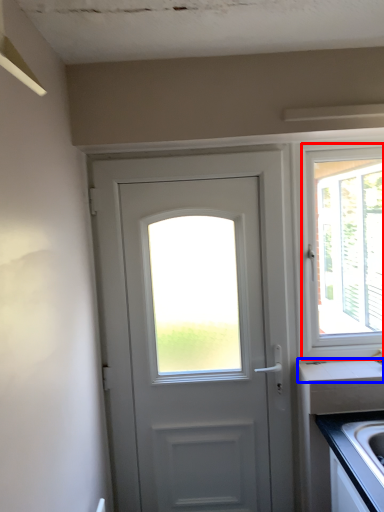
Question: Which of the following is the farthest to the observer, window (highlighted by a red box) or counter top (highlighted by a blue box)?

Choices:
 (A) window
 (B) counter top

Answer: (A)